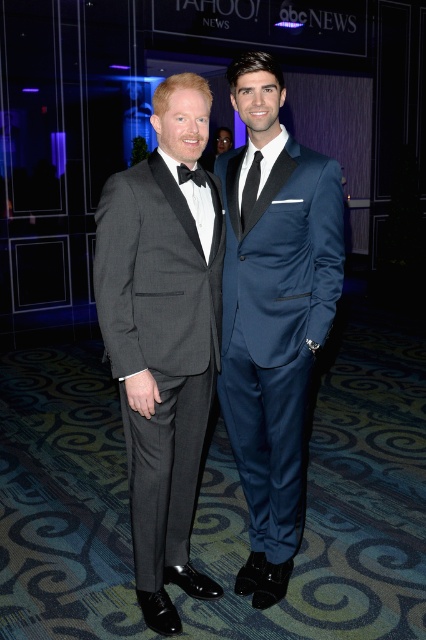
Question: Which point is closer to the camera taking this photo?

Choices:
 (A) (282, 92)
 (B) (166, 536)
 (C) (198, 186)

Answer: (A)

Question: Among these objects, which one is nearest to the camera?

Choices:
 (A) black satin tie at center
 (B) matte black tuxedo at left

Answer: (B)

Question: Is satin blue suit at center thinner than black satin tie at center?

Choices:
 (A) no
 (B) yes

Answer: (A)

Question: Can you confirm if matte black tuxedo at left is bigger than black satin bow tie at center?

Choices:
 (A) no
 (B) yes

Answer: (B)

Question: Which object appears closest to the camera in this image?

Choices:
 (A) matte black tuxedo at left
 (B) black satin bow tie at center
 (C) black satin tie at center
 (D) satin blue suit at center

Answer: (A)

Question: Where is satin blue suit at center located in relation to black satin bow tie at center in the image?

Choices:
 (A) below
 (B) above

Answer: (A)